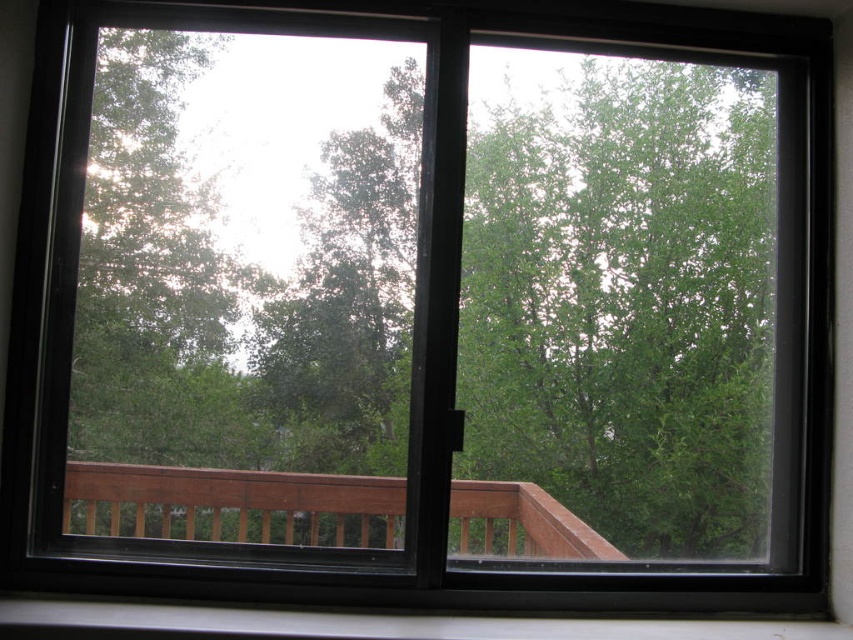
Question: Which point is farther to the camera?

Choices:
 (A) brown wooden rail at center
 (B) white plastic window sill at lower center

Answer: (A)

Question: Can you confirm if brown wooden rail at center is bigger than white plastic window sill at lower center?

Choices:
 (A) no
 (B) yes

Answer: (A)

Question: Among these objects, which one is farthest from the camera?

Choices:
 (A) white plastic window sill at lower center
 (B) brown wooden rail at center

Answer: (B)

Question: Does brown wooden rail at center come in front of white plastic window sill at lower center?

Choices:
 (A) yes
 (B) no

Answer: (B)

Question: Can you confirm if brown wooden rail at center is bigger than white plastic window sill at lower center?

Choices:
 (A) no
 (B) yes

Answer: (A)

Question: Among these objects, which one is farthest from the camera?

Choices:
 (A) white plastic window sill at lower center
 (B) brown wooden rail at center

Answer: (B)